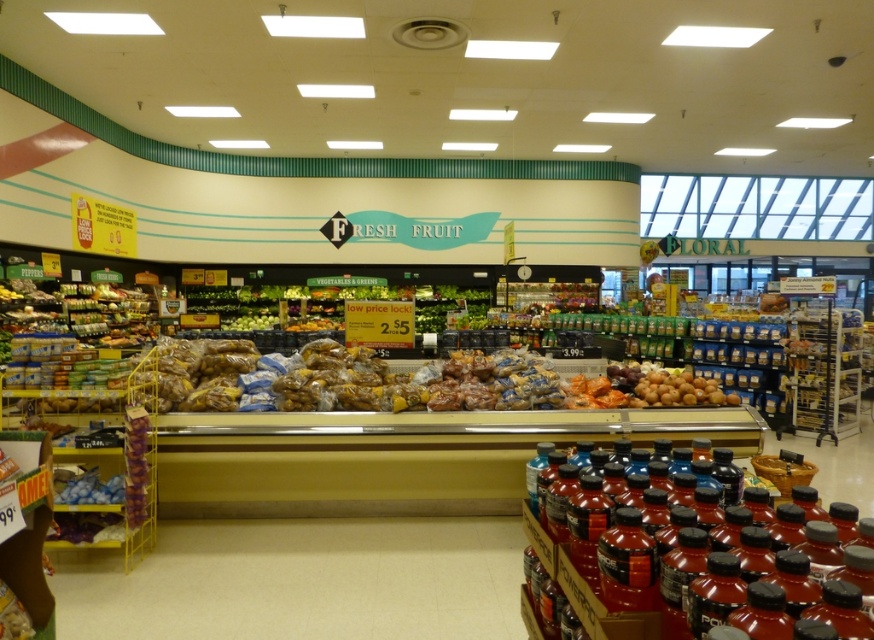
You are a grocery store employee who needs to stack items on a shelf. The shelf has limited height. You have a shiny plastic baguette at center and shiny red plastic bottles at lower right. Which item should you place on the lower shelf to ensure it fits without exceeding the shelf height?

The shiny plastic baguette at center is not as tall as the shiny red plastic bottles at lower right, so you should place the shiny red plastic bottles at lower right on the lower shelf since they are taller and require more vertical space.

You are a grocery store employee who needs to place the shiny plastic baguette at center and the shiny red plastic bottles at lower right on a shelf. The shelf has a width of 50 cm. Can you fit both items side by side without overlapping?

The shiny plastic baguette at center might be wider than shiny red plastic bottles at lower right. If the baguette is wider, the total width of both items could exceed 50 cm, so it might not fit. Check their exact widths before placing them.

Consider the image. You are a customer looking for the shiny red plastic bottles at lower right and the shiny blue jelly beans at lower left in the grocery store. According to the store layout, which one is positioned to the right side of the other?

The shiny red plastic bottles at lower right are positioned to the right of the shiny blue jelly beans at lower left.